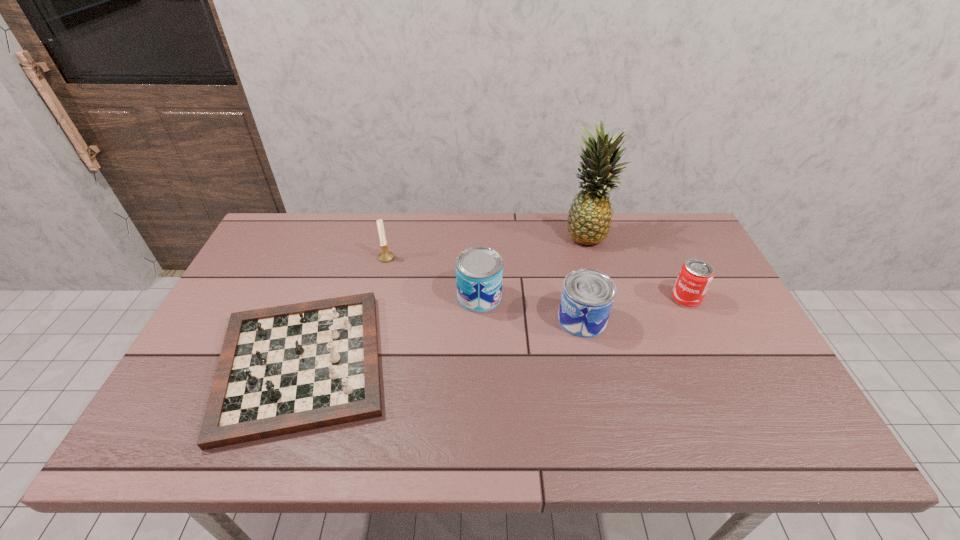
Where is `the tallest object`? Image resolution: width=960 pixels, height=540 pixels. the tallest object is located at coordinates (589, 218).

Find the location of `pineapple`. pineapple is located at coordinates (589, 218).

Where is `the second farthest object`? Image resolution: width=960 pixels, height=540 pixels. the second farthest object is located at coordinates (385, 256).

Find the location of a particular element. This screenshot has width=960, height=540. the leftmost can is located at coordinates (479, 270).

Where is `the second can from left to right`? The image size is (960, 540). the second can from left to right is located at coordinates (587, 297).

Locate an element on the screen. The height and width of the screenshot is (540, 960). the rightmost object is located at coordinates (695, 276).

Locate an element on the screen. the shortest object is located at coordinates tap(286, 369).

This screenshot has height=540, width=960. Identify the location of blank space located on the right of the farthest object. (667, 234).

Where is `vacant space located on the back of the candle holder`? The image size is (960, 540). vacant space located on the back of the candle holder is located at coordinates (393, 232).

This screenshot has height=540, width=960. In order to click on free space located 0.250m on the front of the leftmost can in this screenshot , I will do `click(479, 390)`.